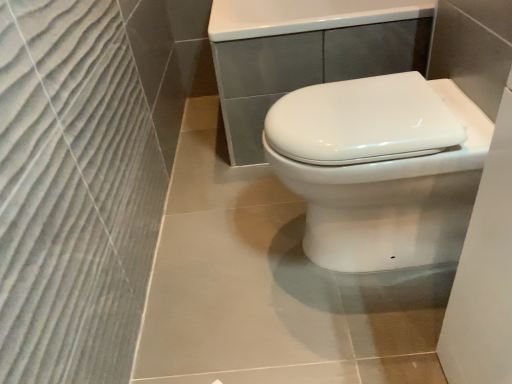
Question: Considering the positions of point (298, 62) and point (334, 226), is point (298, 62) closer or farther from the camera than point (334, 226)?

Choices:
 (A) closer
 (B) farther

Answer: (B)

Question: Is white glossy porcelain at center inside or outside of white glossy toilet at center?

Choices:
 (A) outside
 (B) inside

Answer: (A)

Question: Visually, is white glossy porcelain at center positioned to the left or to the right of white glossy toilet at center?

Choices:
 (A) right
 (B) left

Answer: (A)

Question: Is point (275, 153) positioned closer to the camera than point (254, 29)?

Choices:
 (A) closer
 (B) farther

Answer: (A)

Question: In terms of height, does white glossy toilet at center look taller or shorter compared to white glossy porcelain at center?

Choices:
 (A) short
 (B) tall

Answer: (A)

Question: Would you say white glossy toilet at center is inside or outside white glossy porcelain at center?

Choices:
 (A) inside
 (B) outside

Answer: (B)

Question: Is white glossy toilet at center in front of or behind white glossy porcelain at center in the image?

Choices:
 (A) front
 (B) behind

Answer: (A)